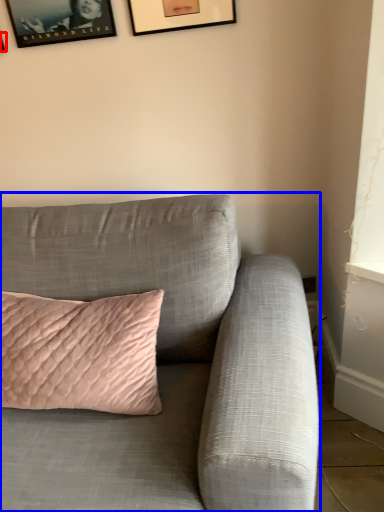
Question: Which point is further to the camera, picture frame (highlighted by a red box) or studio couch (highlighted by a blue box)?

Choices:
 (A) picture frame
 (B) studio couch

Answer: (A)